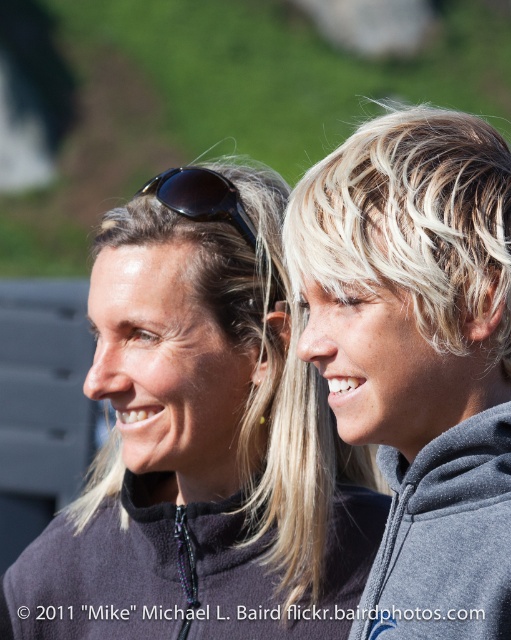
Question: Among these objects, which one is nearest to the camera?

Choices:
 (A) blondehair at right
 (B) black plastic sunglasses at upper center
 (C) gray fleece sweatshirt at right

Answer: (C)

Question: Is dark gray fleece sweatshirt at center to the left of gray fleece sweatshirt at right from the viewer's perspective?

Choices:
 (A) no
 (B) yes

Answer: (B)

Question: Which point is closer to the camera?

Choices:
 (A) gray fleece sweatshirt at right
 (B) dark gray fleece sweatshirt at center
 (C) black plastic sunglasses at upper center

Answer: (A)

Question: Can you confirm if dark gray fleece sweatshirt at center is positioned below gray fleece sweatshirt at right?

Choices:
 (A) yes
 (B) no

Answer: (A)

Question: Which point is farther to the camera?

Choices:
 (A) dark gray fleece sweatshirt at center
 (B) black plastic sunglasses at upper center
 (C) gray fleece sweatshirt at right
 (D) dark gray fleece at center

Answer: (A)

Question: Can you confirm if dark gray fleece at center is wider than dark gray fleece sweatshirt at center?

Choices:
 (A) no
 (B) yes

Answer: (B)